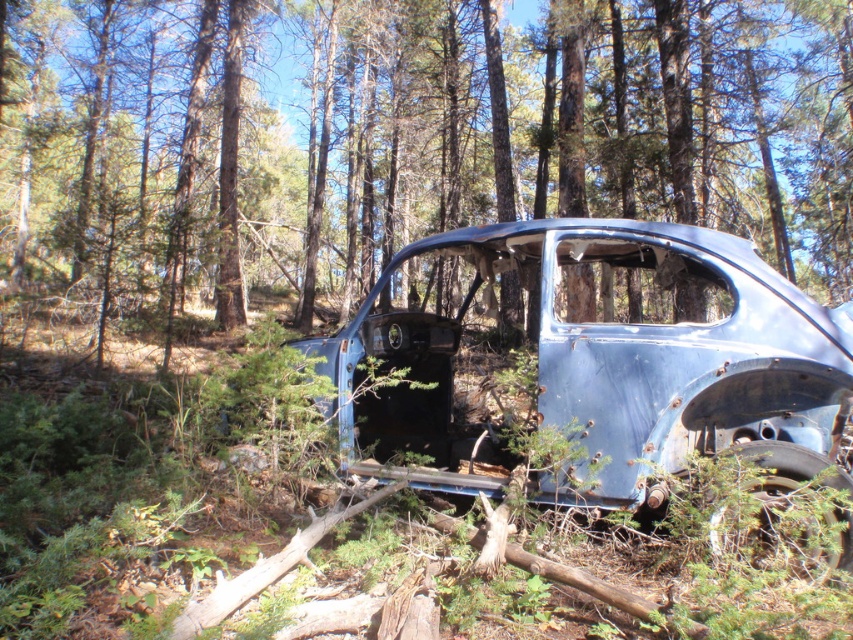
Can you confirm if blue metallic car at center is positioned to the right of rusty metal car at center?

In fact, blue metallic car at center is to the left of rusty metal car at center.

Who is more forward, [544,60] or [608,342]?

Point [608,342] is more forward.

Locate an element on the screen. The image size is (853, 640). blue metallic car at center is located at coordinates (395, 145).